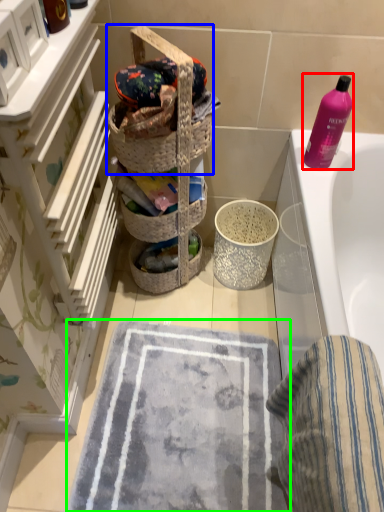
Question: Which object is positioned farthest from cleaning product (highlighted by a red box)? Select from picnic basket (highlighted by a blue box) and bath mat (highlighted by a green box).

Choices:
 (A) picnic basket
 (B) bath mat

Answer: (B)